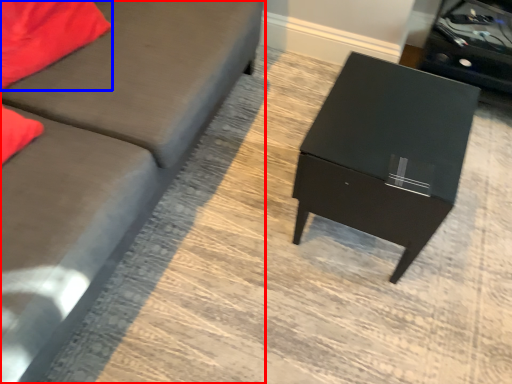
Question: Which of the following is the farthest to the observer, studio couch (highlighted by a red box) or pillow (highlighted by a blue box)?

Choices:
 (A) studio couch
 (B) pillow

Answer: (B)